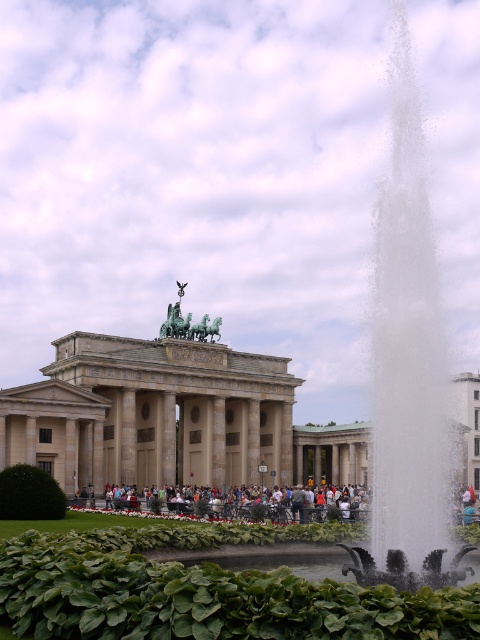
You are standing in front of the Brandenburg Gate and see the light gray concrete people at center and the green polished stone sculpture at center. Which object is nearer to you?

The light gray concrete people at center are closer to the viewer than the green polished stone sculpture at center.